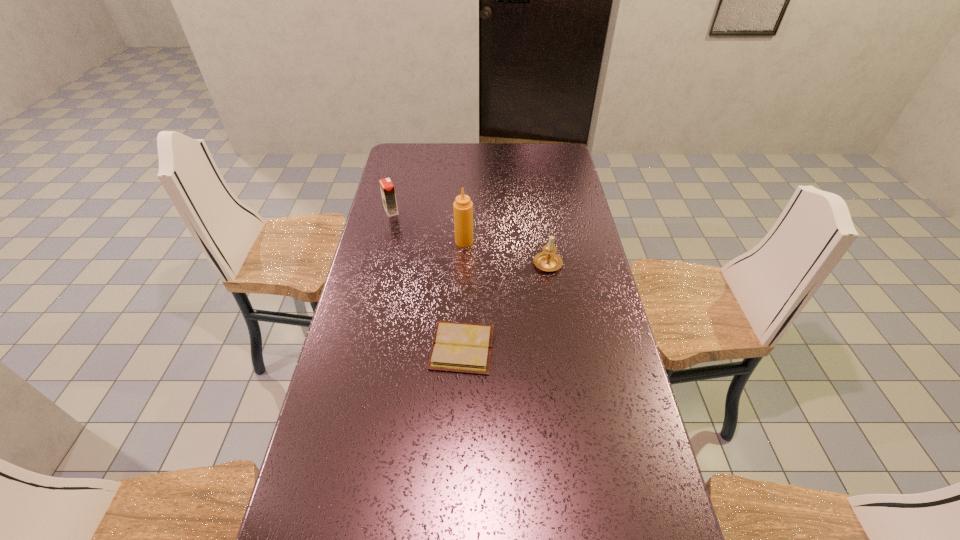
This screenshot has height=540, width=960. In order to click on vacant region located with a handle on the side of the third farthest object in this screenshot , I will do tap(542, 233).

Locate an element on the screen. This screenshot has height=540, width=960. vacant point located 0.260m with a handle on the side of the third farthest object is located at coordinates (539, 208).

At what (x,y) coordinates should I click in order to perform the action: click on vacant position located 0.360m with a handle on the side of the third farthest object. Please return your answer as a coordinate pair (x, y). Looking at the image, I should click on (537, 194).

Find the location of `free region located on the back of the shortest object`. free region located on the back of the shortest object is located at coordinates (464, 292).

The height and width of the screenshot is (540, 960). Find the location of `object that is at the left edge`. object that is at the left edge is located at coordinates (387, 188).

This screenshot has height=540, width=960. In order to click on object that is at the right edge in this screenshot , I will do `click(548, 260)`.

Where is `vacant space at the left edge of the desktop`? The height and width of the screenshot is (540, 960). vacant space at the left edge of the desktop is located at coordinates tap(398, 187).

Where is `vacant space at the right edge of the desktop`? vacant space at the right edge of the desktop is located at coordinates (577, 237).

In the image, there is a desktop. Identify the location of vacant space at the far left corner. Image resolution: width=960 pixels, height=540 pixels. (401, 156).

Where is `blank area at the far right corner`? blank area at the far right corner is located at coordinates (563, 146).